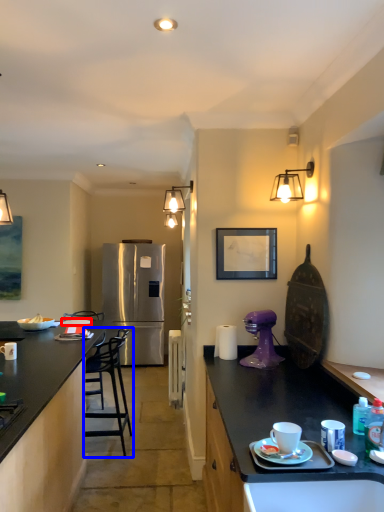
Question: Among these objects, which one is farthest to the camera, tableware (highlighted by a red box) or chair (highlighted by a blue box)?

Choices:
 (A) tableware
 (B) chair

Answer: (A)